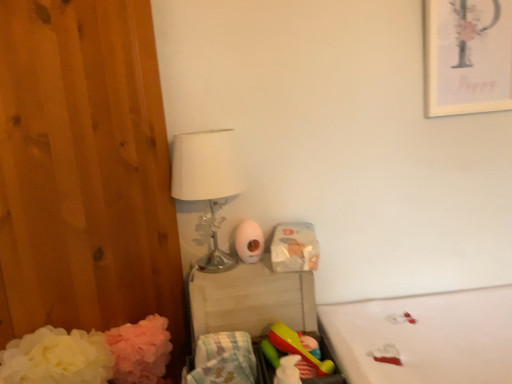
Question: Is plastic changing table at center surrounding pastel cotton blanket at lower center?

Choices:
 (A) yes
 (B) no

Answer: (B)

Question: Is the depth of plastic changing table at center less than that of pastel cotton blanket at lower center?

Choices:
 (A) no
 (B) yes

Answer: (A)

Question: Is plastic changing table at center further to camera compared to pastel cotton blanket at lower center?

Choices:
 (A) no
 (B) yes

Answer: (B)

Question: Is plastic changing table at center positioned with its back to pastel cotton blanket at lower center?

Choices:
 (A) yes
 (B) no

Answer: (B)

Question: Does plastic changing table at center have a greater width compared to pastel cotton blanket at lower center?

Choices:
 (A) no
 (B) yes

Answer: (A)

Question: Considering the relative sizes of plastic changing table at center and pastel cotton blanket at lower center in the image provided, is plastic changing table at center thinner than pastel cotton blanket at lower center?

Choices:
 (A) no
 (B) yes

Answer: (B)

Question: Considering the relative sizes of white fabric mattress at lower right and white glossy toilet paper at center in the image provided, is white fabric mattress at lower right bigger than white glossy toilet paper at center?

Choices:
 (A) yes
 (B) no

Answer: (A)

Question: From the image's perspective, does white fabric mattress at lower right appear lower than white glossy toilet paper at center?

Choices:
 (A) no
 (B) yes

Answer: (B)

Question: Is white fabric mattress at lower right wider than white glossy toilet paper at center?

Choices:
 (A) no
 (B) yes

Answer: (B)

Question: Is white fabric mattress at lower right turned away from white glossy toilet paper at center?

Choices:
 (A) yes
 (B) no

Answer: (B)

Question: Is white fabric mattress at lower right thinner than white glossy toilet paper at center?

Choices:
 (A) no
 (B) yes

Answer: (A)

Question: Is white fabric mattress at lower right oriented towards white glossy toilet paper at center?

Choices:
 (A) no
 (B) yes

Answer: (A)

Question: Can you confirm if matte white picture frame at upper right is positioned to the left of white fabric mattress at lower right?

Choices:
 (A) yes
 (B) no

Answer: (B)